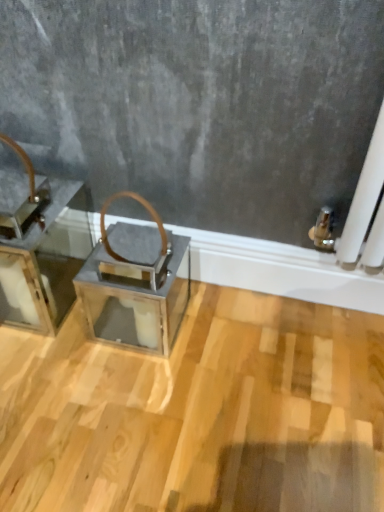
Question: From a real-world perspective, is metallic gray lantern at center physically above metallic silver tray at left?

Choices:
 (A) yes
 (B) no

Answer: (B)

Question: Does metallic gray lantern at center have a smaller size compared to metallic silver tray at left?

Choices:
 (A) yes
 (B) no

Answer: (A)

Question: Is metallic gray lantern at center wider than metallic silver tray at left?

Choices:
 (A) no
 (B) yes

Answer: (A)

Question: Would you say metallic silver tray at left is part of metallic gray lantern at center's contents?

Choices:
 (A) yes
 (B) no

Answer: (B)

Question: Could you tell me if metallic gray lantern at center is facing metallic silver tray at left?

Choices:
 (A) yes
 (B) no

Answer: (B)

Question: Can you confirm if metallic gray lantern at center is thinner than metallic silver tray at left?

Choices:
 (A) yes
 (B) no

Answer: (A)

Question: Considering the relative sizes of metallic silver tray at left and metallic gray lantern at center in the image provided, is metallic silver tray at left shorter than metallic gray lantern at center?

Choices:
 (A) yes
 (B) no

Answer: (B)

Question: From a real-world perspective, is metallic silver tray at left on metallic gray lantern at center?

Choices:
 (A) no
 (B) yes

Answer: (B)

Question: Considering the relative positions of metallic silver tray at left and metallic gray lantern at center in the image provided, is metallic silver tray at left to the right of metallic gray lantern at center from the viewer's perspective?

Choices:
 (A) no
 (B) yes

Answer: (A)

Question: Can you confirm if metallic silver tray at left is bigger than metallic gray lantern at center?

Choices:
 (A) no
 (B) yes

Answer: (B)

Question: From the image's perspective, is metallic silver tray at left above metallic gray lantern at center?

Choices:
 (A) no
 (B) yes

Answer: (B)

Question: Is metallic silver tray at left wider than metallic gray lantern at center?

Choices:
 (A) no
 (B) yes

Answer: (B)

Question: In terms of height, does metallic silver tray at left look taller or shorter compared to metallic gray lantern at center?

Choices:
 (A) short
 (B) tall

Answer: (B)